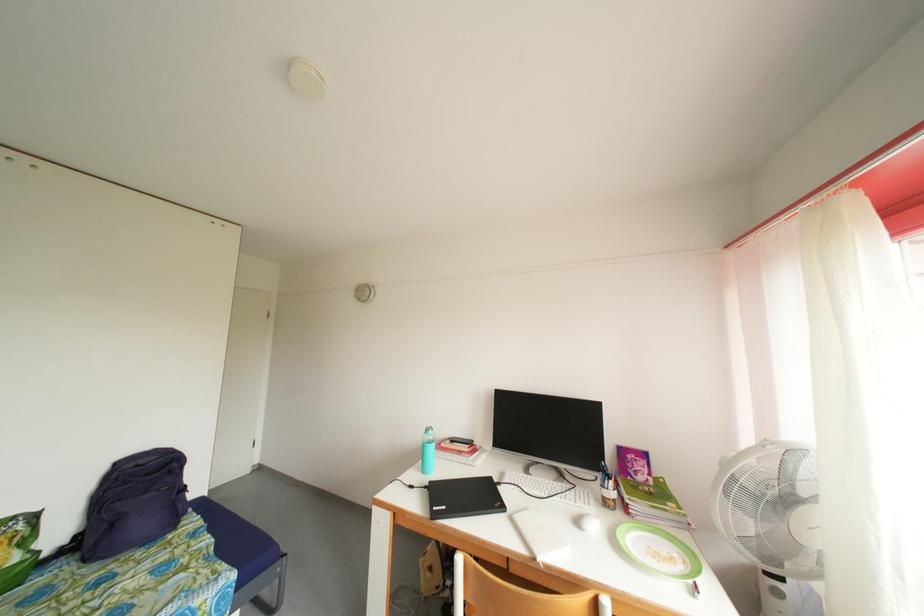
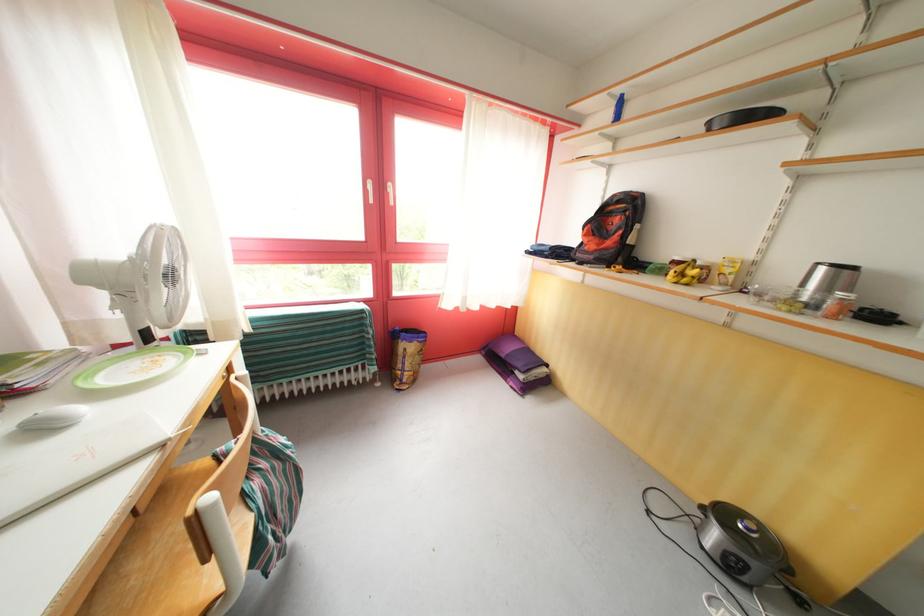
In the second image, find the point that corresponds to the point at 679,545 in the first image.

(128, 363)